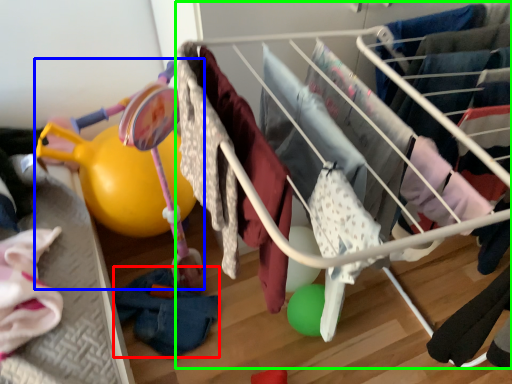
Question: Based on their relative distances, which object is farther from clothing (highlighted by a red box)? Choose from baby carriage (highlighted by a blue box) and infant bed (highlighted by a green box).

Choices:
 (A) baby carriage
 (B) infant bed

Answer: (B)